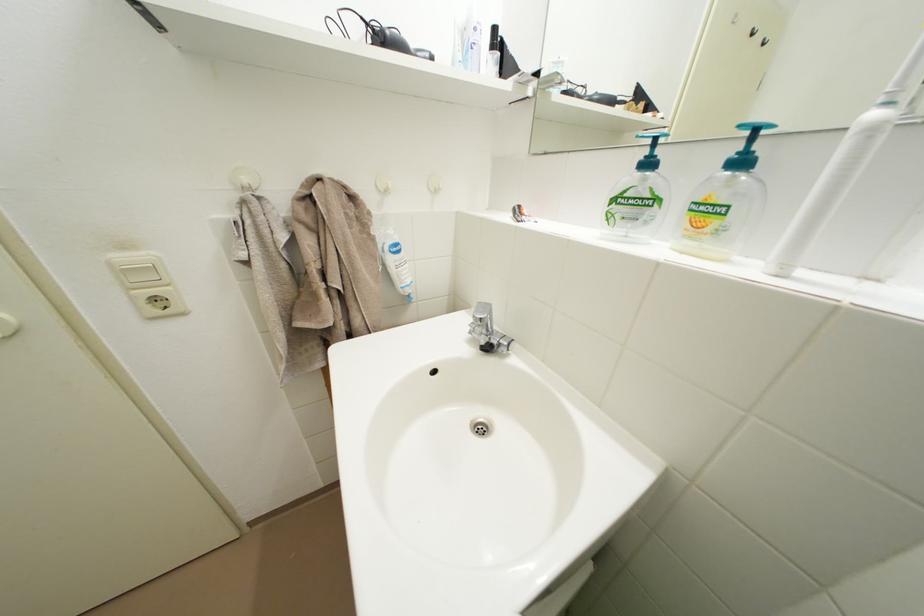
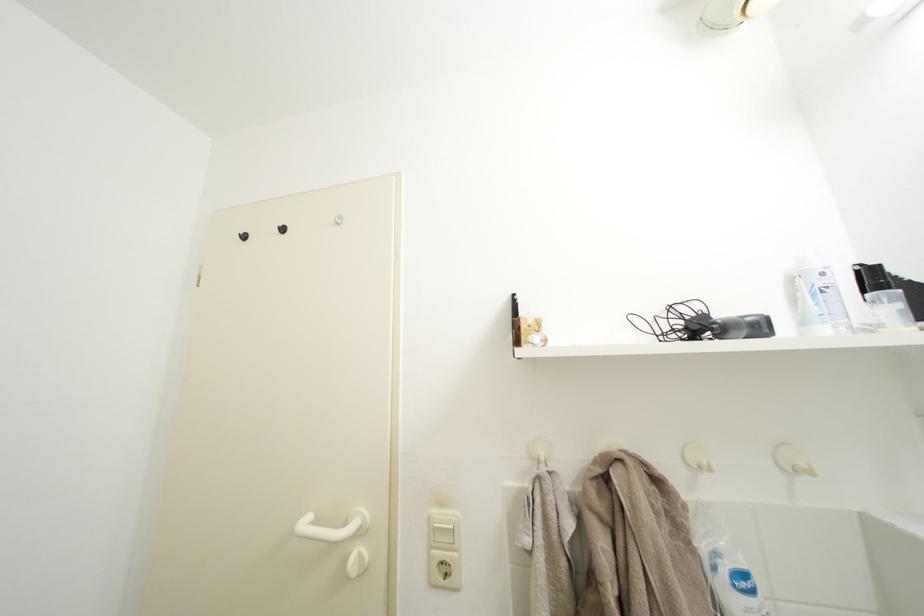
The images are taken continuously from a first-person perspective. In which direction is your viewpoint rotating?

The camera rotated toward left-up.